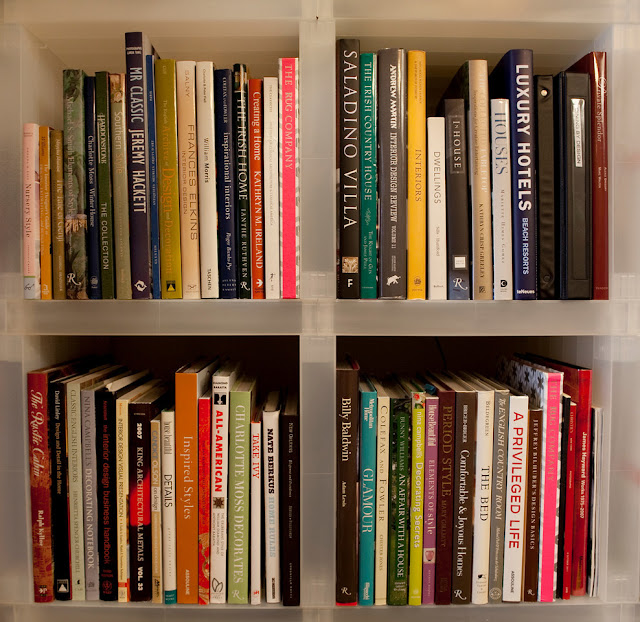
Where is `orange bookes`? orange bookes is located at coordinates (180, 423).